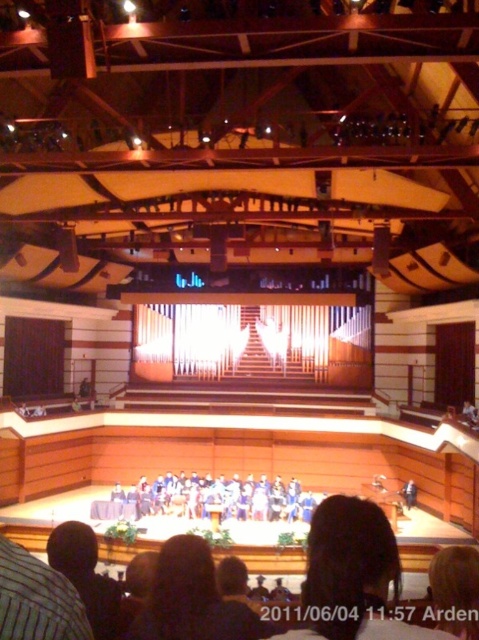
Question: Among these objects, which one is nearest to the camera?

Choices:
 (A) dark brown hair at center
 (B) blue fabric chairs at center

Answer: (A)

Question: Is dark hair at center above black fabric at lower left?

Choices:
 (A) no
 (B) yes

Answer: (A)

Question: Is the position of dark brown hair at center more distant than that of blue fabric chairs at center?

Choices:
 (A) yes
 (B) no

Answer: (B)

Question: Estimate the real-world distances between objects in this image. Which object is closer to the black fabric at lower left?

Choices:
 (A) dark hair at center
 (B) dark brown hair at center
 (C) blue fabric chairs at center

Answer: (A)

Question: Which point is farther to the camera?

Choices:
 (A) (77, 522)
 (B) (183, 532)
 (C) (136, 502)
 (D) (369, 547)

Answer: (C)

Question: Can you confirm if dark brown hair at center is bigger than dark hair at center?

Choices:
 (A) no
 (B) yes

Answer: (B)